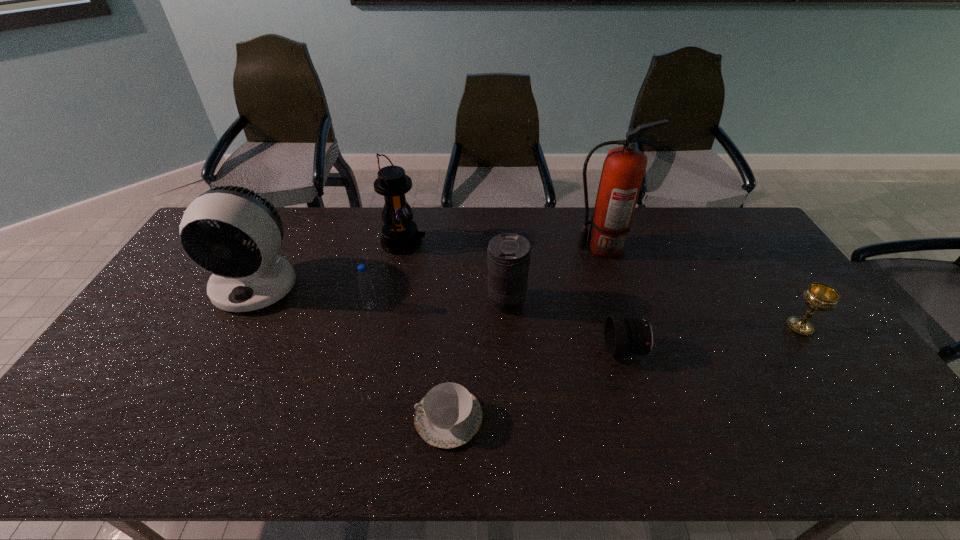
The image size is (960, 540). I want to click on the tallest object, so click(623, 170).

Where is `lantern`? lantern is located at coordinates (400, 235).

What are the coordinates of `the leftmost object` in the screenshot? It's located at (x=242, y=280).

Find the location of `the farther telephoto lens`. the farther telephoto lens is located at coordinates (508, 255).

At what (x,y) coordinates should I click in order to perform the action: click on the taller telephoto lens. Please return your answer as a coordinate pair (x, y). Looking at the image, I should click on (508, 255).

You are a GUI agent. You are given a task and a screenshot of the screen. Output one action in this format:
    pyautogui.click(x=<x>, y=<y>)
    Task: Click on the water bottle
    This screenshot has width=960, height=540.
    Given the screenshot: What is the action you would take?
    pyautogui.click(x=364, y=279)

Identify the location of chalice. (818, 296).

Locate an element on the screen. This screenshot has width=960, height=540. the seventh tallest object is located at coordinates (623, 336).

Where is `the shorter telephoto lens`? the shorter telephoto lens is located at coordinates (623, 336).

Locate an element on the screen. chinaware is located at coordinates (448, 416).